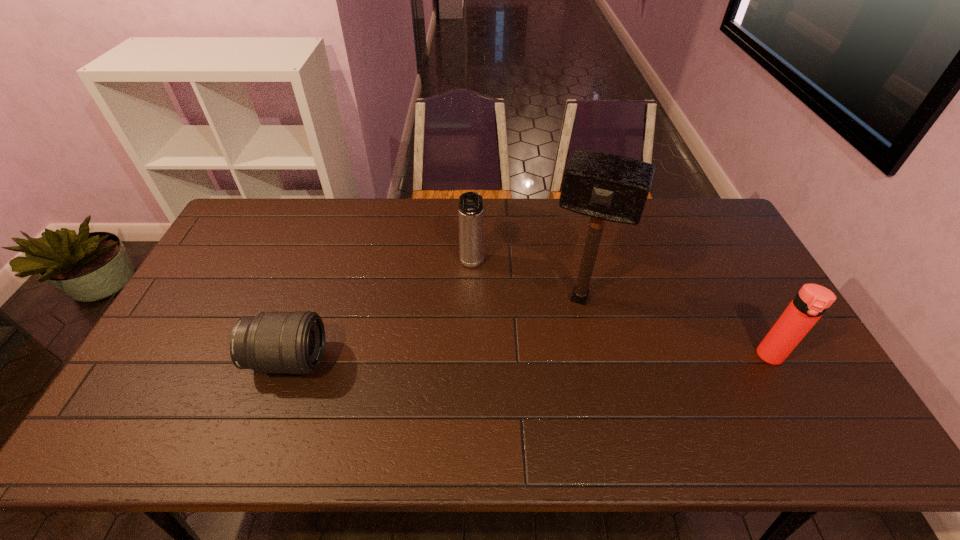
This screenshot has height=540, width=960. Identify the location of vacant area situated on the handle side of the farther thermos bottle. (471, 340).

Find the location of a particular element. vacant position located 0.100m on the handle side of the farther thermos bottle is located at coordinates (471, 301).

Locate an element on the screen. free spot located 0.340m on the handle side of the farther thermos bottle is located at coordinates (471, 371).

Locate an element on the screen. The height and width of the screenshot is (540, 960). free region located 0.180m on the head of the second farthest object is located at coordinates (553, 368).

Locate an element on the screen. This screenshot has width=960, height=540. free space located 0.060m on the head of the second farthest object is located at coordinates [564, 334].

Where is `vacant space situated 0.190m on the head of the second farthest object`? This screenshot has width=960, height=540. vacant space situated 0.190m on the head of the second farthest object is located at coordinates (552, 371).

The height and width of the screenshot is (540, 960). I want to click on object that is at the near edge, so click(x=271, y=342).

Where is `object positioned at the right edge`? object positioned at the right edge is located at coordinates point(812,301).

Identify the location of free space at the far edge. This screenshot has height=540, width=960. (454, 221).

The height and width of the screenshot is (540, 960). I want to click on vacant region at the near edge of the desktop, so click(x=517, y=406).